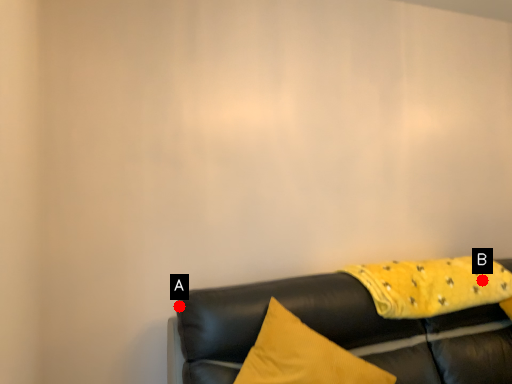
Question: Two points are circled on the image, labeled by A and B beside each circle. Which point appears closest to the camera in this image?

Choices:
 (A) A is closer
 (B) B is closer

Answer: (A)